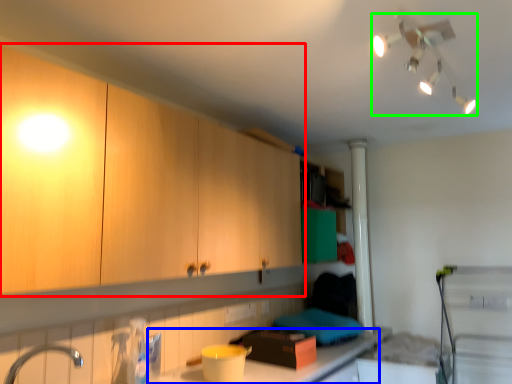
Question: Which is farther away from cabinetry (highlighted by a red box)? countertop (highlighted by a blue box) or light fixture (highlighted by a green box)?

Choices:
 (A) countertop
 (B) light fixture

Answer: (B)